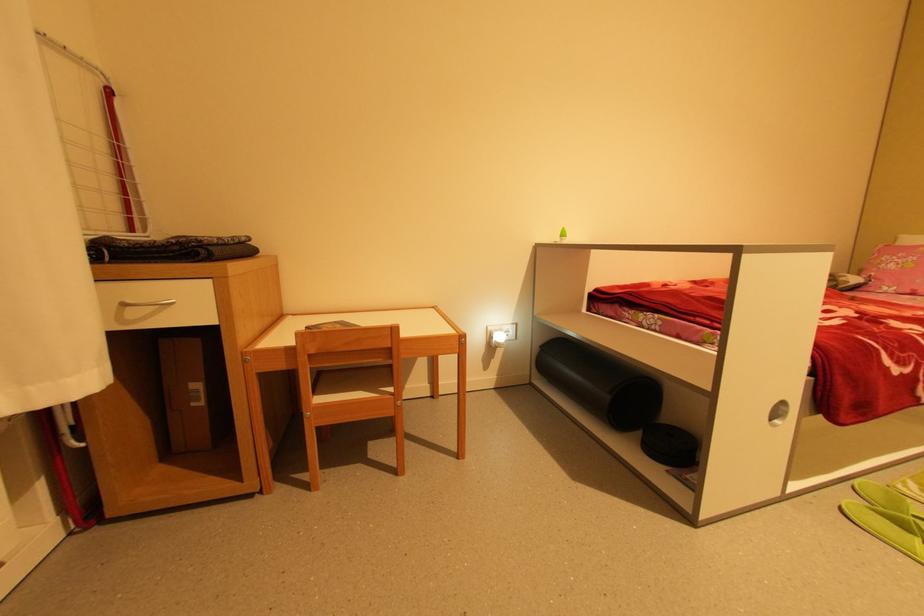
You are a GUI agent. You are given a task and a screenshot of the screen. Output one action in this format:
    pyautogui.click(x=<x>, y=<y>)
    Task: Click on the small black container
    This screenshot has width=924, height=616.
    Given the screenshot: What is the action you would take?
    pyautogui.click(x=669, y=445)